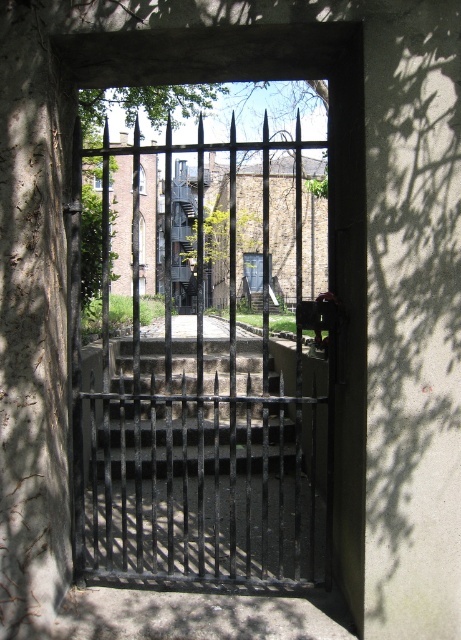
Does black wrought iron gate at center appear over green leafy tree at upper center?

No, black wrought iron gate at center is not above green leafy tree at upper center.

Does black wrought iron gate at center have a greater width compared to green leafy tree at upper center?

Indeed, black wrought iron gate at center has a greater width compared to green leafy tree at upper center.

Is point (296, 198) less distant than point (90, 113)?

Yes, point (296, 198) is in front of point (90, 113).

This screenshot has height=640, width=461. Identify the location of black wrought iron gate at center. (205, 392).

Between green leafy tree at upper center and metallic gray staircase at center, which one appears on the right side from the viewer's perspective?

green leafy tree at upper center

Is green leafy tree at upper center above metallic gray staircase at center?

Yes.

Who is more forward, (124, 116) or (188, 237)?

Point (124, 116)

This screenshot has height=640, width=461. In order to click on green leafy tree at upper center in this screenshot , I will do `click(145, 104)`.

Does point (308, 419) come in front of point (177, 252)?

Yes, it is in front of point (177, 252).

Who is shorter, black wrought iron gate at center or metallic gray staircase at center?

With less height is metallic gray staircase at center.

The height and width of the screenshot is (640, 461). What do you see at coordinates (205, 392) in the screenshot?
I see `black wrought iron gate at center` at bounding box center [205, 392].

You are a GUI agent. You are given a task and a screenshot of the screen. Output one action in this format:
    pyautogui.click(x=<x>, y=<y>)
    Task: Click on the black wrought iron gate at center
    
    Given the screenshot: What is the action you would take?
    pyautogui.click(x=205, y=392)